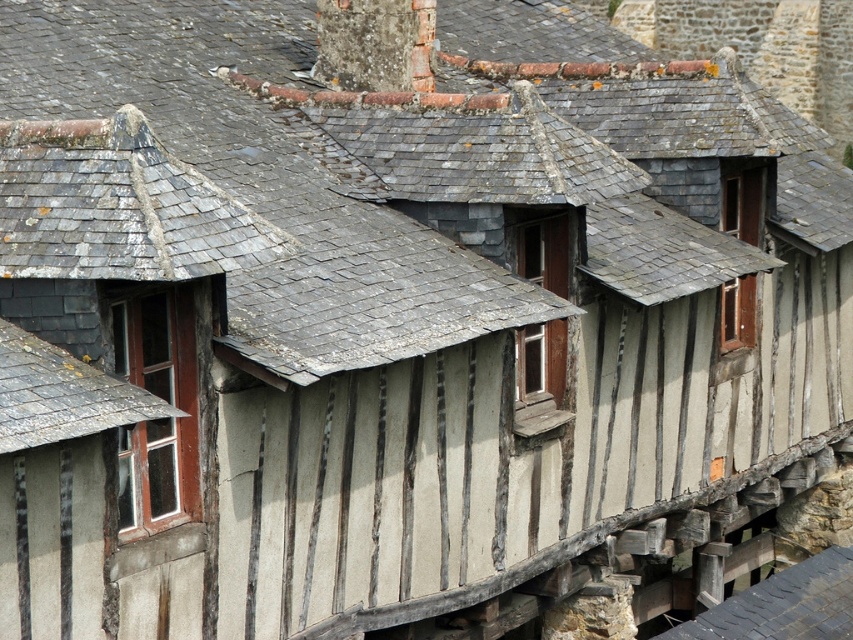
You are standing in front of a row of traditional timber houses in a historic European village. You see a point marked at coordinates point (561, 244). If you want to take a photo of this point, will you need to zoom in your camera to capture it clearly?

The point (561, 244) is 47.49 meters away from you. Since it is quite far, you would need to zoom in your camera to capture it clearly.

You are a tourist standing in front of the row of traditional timber houses. You see the gray slate roof at lower left and the brown wooden window at center. Which object is positioned to the left of the other?

The gray slate roof at lower left is to the left of the brown wooden window at center.